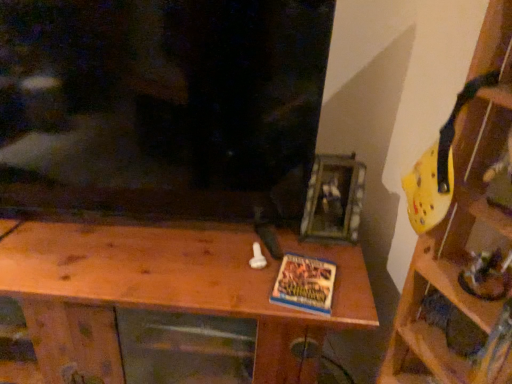
What is the approximate height of blue matte book at center?

It is 2.46 centimeters.

Locate an element on the screen. This screenshot has height=384, width=512. yellow plastic helmet at upper right, arranged as the second shelf when viewed from the left is located at coordinates (461, 238).

Which object is more forward, wooden at center, which is the second shelf in right-to-left order, or yellow plastic helmet at upper right, arranged as the second shelf when viewed from the left?

yellow plastic helmet at upper right, arranged as the second shelf when viewed from the left.

From a real-world perspective, is wooden at center, which is the second shelf in right-to-left order, physically above yellow plastic helmet at upper right, the first shelf from the right?

No, from a real-world perspective, wooden at center, which is the second shelf in right-to-left order, is not over yellow plastic helmet at upper right, the first shelf from the right

Is wooden at center, which is the second shelf in right-to-left order, positioned with its back to yellow plastic helmet at upper right, the first shelf from the right?

No.

Consider the image. In terms of width, does wooden at center, positioned as the 1th shelf in left-to-right order, look wider or thinner when compared to yellow plastic helmet at upper right, arranged as the second shelf when viewed from the left?

In the image, wooden at center, positioned as the 1th shelf in left-to-right order, appears to be wider than yellow plastic helmet at upper right, arranged as the second shelf when viewed from the left.

Does blue matte book at center come behind yellow plastic helmet at upper right, the first shelf from the right?

Yes, it is behind yellow plastic helmet at upper right, the first shelf from the right.

Looking at their sizes, would you say blue matte book at center is wider or thinner than yellow plastic helmet at upper right, arranged as the second shelf when viewed from the left?

In the image, blue matte book at center appears to be more narrow than yellow plastic helmet at upper right, arranged as the second shelf when viewed from the left.

From the image's perspective, relative to yellow plastic helmet at upper right, arranged as the second shelf when viewed from the left, is blue matte book at center above or below?

From the image's perspective, blue matte book at center appears below yellow plastic helmet at upper right, arranged as the second shelf when viewed from the left.

Can we say blue matte book at center lies outside yellow plastic helmet at upper right, arranged as the second shelf when viewed from the left?

Yes.

Does yellow plastic helmet at upper right, arranged as the second shelf when viewed from the left, lie behind wooden at center, positioned as the 1th shelf in left-to-right order?

That is False.

Is yellow plastic helmet at upper right, arranged as the second shelf when viewed from the left, facing towards wooden at center, positioned as the 1th shelf in left-to-right order?

No, yellow plastic helmet at upper right, arranged as the second shelf when viewed from the left, is not oriented towards wooden at center, positioned as the 1th shelf in left-to-right order.

Considering the relative sizes of yellow plastic helmet at upper right, the first shelf from the right, and wooden at center, which is the second shelf in right-to-left order, in the image provided, is yellow plastic helmet at upper right, the first shelf from the right, wider than wooden at center, which is the second shelf in right-to-left order,?

No, yellow plastic helmet at upper right, the first shelf from the right, is not wider than wooden at center, which is the second shelf in right-to-left order.

Measure the distance from yellow plastic helmet at upper right, arranged as the second shelf when viewed from the left, to wooden at center, positioned as the 1th shelf in left-to-right order.

yellow plastic helmet at upper right, arranged as the second shelf when viewed from the left, and wooden at center, positioned as the 1th shelf in left-to-right order, are 16.85 inches apart.

Is point (308, 294) less distant than point (275, 365)?

Yes, point (308, 294) is in front of point (275, 365).

From a real-world perspective, which object stands above the other?

In real-world perspective, blue matte book at center is above.

Is wooden at center, which is the second shelf in right-to-left order, a part of blue matte book at center?

No, wooden at center, which is the second shelf in right-to-left order, is located outside of blue matte book at center.

Would you consider blue matte book at center to be distant from wooden at center, positioned as the 1th shelf in left-to-right order?

That's not correct — blue matte book at center is a little close to wooden at center, positioned as the 1th shelf in left-to-right order.

Is there a large distance between wooden at center, which is the second shelf in right-to-left order, and blue matte book at center?

That's not correct — wooden at center, which is the second shelf in right-to-left order, is a little close to blue matte book at center.

Consider the image. Considering the relative sizes of wooden at center, positioned as the 1th shelf in left-to-right order, and blue matte book at center in the image provided, is wooden at center, positioned as the 1th shelf in left-to-right order, bigger than blue matte book at center?

Yes.

From the image's perspective, which one is positioned higher, wooden at center, which is the second shelf in right-to-left order, or blue matte book at center?

blue matte book at center appears higher in the image.

Can you confirm if wooden at center, positioned as the 1th shelf in left-to-right order, is wider than blue matte book at center?

Yes.

From a real-world perspective, relative to blue matte book at center, is yellow plastic helmet at upper right, arranged as the second shelf when viewed from the left, vertically above or below?

From a real-world perspective, yellow plastic helmet at upper right, arranged as the second shelf when viewed from the left, is physically above blue matte book at center.

The width and height of the screenshot is (512, 384). I want to click on book below the yellow plastic helmet at upper right, the first shelf from the right (from a real-world perspective), so click(x=305, y=284).

Is the position of yellow plastic helmet at upper right, the first shelf from the right, less distant than that of blue matte book at center?

Yes, yellow plastic helmet at upper right, the first shelf from the right, is in front of blue matte book at center.

Would you say blue matte book at center is part of yellow plastic helmet at upper right, the first shelf from the right,'s contents?

No, blue matte book at center is not inside yellow plastic helmet at upper right, the first shelf from the right.

The height and width of the screenshot is (384, 512). Find the location of `shelf above the wooden at center, positioned as the 1th shelf in left-to-right order (from a real-world perspective)`. shelf above the wooden at center, positioned as the 1th shelf in left-to-right order (from a real-world perspective) is located at coordinates (461, 238).

From the blue matte book at center, count 2nd shelfs forward and point to it. Please provide its 2D coordinates.

[(461, 238)]

Based on their spatial positions, is wooden at center, which is the second shelf in right-to-left order, or yellow plastic helmet at upper right, the first shelf from the right, closer to blue matte book at center?

Based on the image, wooden at center, which is the second shelf in right-to-left order, appears to be nearer to blue matte book at center.

Estimate the real-world distances between objects in this image. Which object is further from yellow plastic helmet at upper right, arranged as the second shelf when viewed from the left, blue matte book at center or wooden at center, positioned as the 1th shelf in left-to-right order?

Among the two, wooden at center, positioned as the 1th shelf in left-to-right order, is located further to yellow plastic helmet at upper right, arranged as the second shelf when viewed from the left.

Based on their spatial positions, is yellow plastic helmet at upper right, arranged as the second shelf when viewed from the left, or wooden at center, positioned as the 1th shelf in left-to-right order, further from blue matte book at center?

yellow plastic helmet at upper right, arranged as the second shelf when viewed from the left, is further to blue matte book at center.

Looking at the image, which one is located closer to wooden at center, positioned as the 1th shelf in left-to-right order, blue matte book at center or yellow plastic helmet at upper right, the first shelf from the right?

Among the two, blue matte book at center is located nearer to wooden at center, positioned as the 1th shelf in left-to-right order.

When comparing their distances from wooden at center, positioned as the 1th shelf in left-to-right order, does yellow plastic helmet at upper right, the first shelf from the right, or blue matte book at center seem closer?

Among the two, blue matte book at center is located nearer to wooden at center, positioned as the 1th shelf in left-to-right order.

When comparing their distances from yellow plastic helmet at upper right, the first shelf from the right, does wooden at center, which is the second shelf in right-to-left order, or blue matte book at center seem closer?

blue matte book at center lies closer to yellow plastic helmet at upper right, the first shelf from the right, than the other object.

Image resolution: width=512 pixels, height=384 pixels. Identify the location of book between wooden at center, which is the second shelf in right-to-left order, and yellow plastic helmet at upper right, arranged as the second shelf when viewed from the left. coord(305,284).